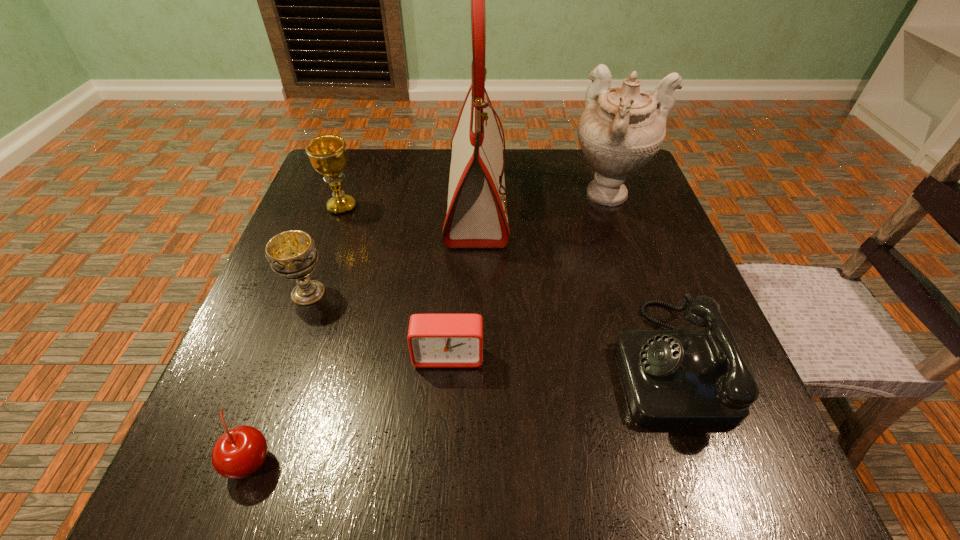
Select which object is the second closest to the telephone. Please provide its 2D coordinates. Your answer should be formatted as a tuple, i.e. [(x, y)], where the tuple contains the x and y coordinates of a point satisfying the conditions above.

[(435, 340)]

I want to click on free region that satisfies the following two spatial constraints: 1. on the back side of the urn; 2. on the left side of the fifth shortest object, so click(x=347, y=196).

Find the location of a particular element. vacant space that satisfies the following two spatial constraints: 1. on the back side of the third tallest object; 2. on the left side of the shorter chalice is located at coordinates (340, 207).

Where is `free space that satisfies the following two spatial constraints: 1. on the back side of the second tallest object; 2. on the left side of the nearer chalice`? The width and height of the screenshot is (960, 540). free space that satisfies the following two spatial constraints: 1. on the back side of the second tallest object; 2. on the left side of the nearer chalice is located at coordinates (344, 196).